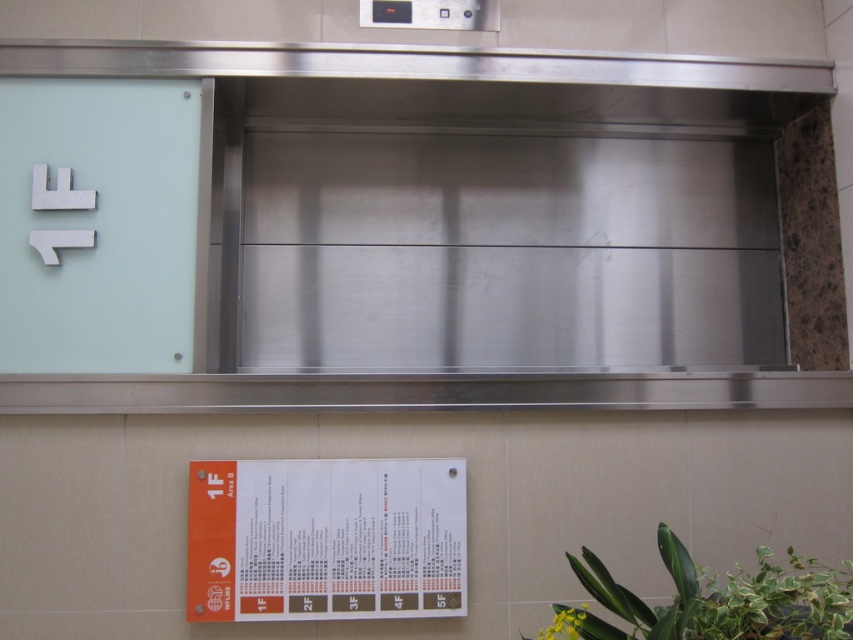
Question: Among these objects, which one is nearest to the camera?

Choices:
 (A) orange paper at lower center
 (B) green leafy plant at lower right

Answer: (B)

Question: Can you confirm if orange paper at lower center is positioned to the left of green leafy plant at lower right?

Choices:
 (A) yes
 (B) no

Answer: (A)

Question: Does orange paper at lower center appear over green leafy plant at lower right?

Choices:
 (A) no
 (B) yes

Answer: (B)

Question: Can you confirm if orange paper at lower center is positioned to the left of green leafy plant at lower right?

Choices:
 (A) no
 (B) yes

Answer: (B)